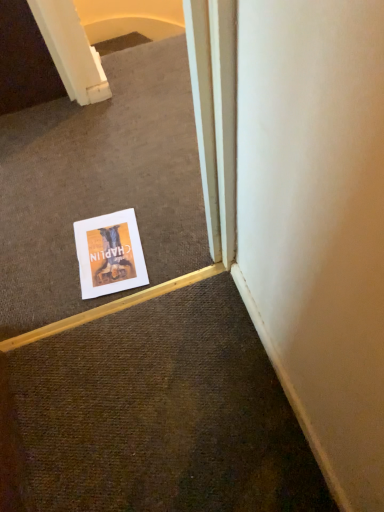
Question: Is white paper poster at center to the right of white paper at center from the viewer's perspective?

Choices:
 (A) no
 (B) yes

Answer: (B)

Question: Is white paper poster at center smaller than white paper at center?

Choices:
 (A) no
 (B) yes

Answer: (B)

Question: Would you say white paper poster at center is outside white paper at center?

Choices:
 (A) no
 (B) yes

Answer: (A)

Question: Can you confirm if white paper poster at center is taller than white paper at center?

Choices:
 (A) no
 (B) yes

Answer: (A)

Question: Can you confirm if white paper poster at center is bigger than white paper at center?

Choices:
 (A) no
 (B) yes

Answer: (A)

Question: Considering the relative sizes of white paper poster at center and white paper at center in the image provided, is white paper poster at center shorter than white paper at center?

Choices:
 (A) no
 (B) yes

Answer: (B)

Question: From the image's perspective, is white paper at center located beneath white paper poster at center?

Choices:
 (A) yes
 (B) no

Answer: (B)

Question: Is white paper at center closer to the viewer compared to white paper poster at center?

Choices:
 (A) no
 (B) yes

Answer: (B)

Question: From a real-world perspective, is white paper at center physically above white paper poster at center?

Choices:
 (A) yes
 (B) no

Answer: (A)

Question: Is white paper at center to the right of white paper poster at center from the viewer's perspective?

Choices:
 (A) no
 (B) yes

Answer: (A)

Question: Is white paper at center located outside white paper poster at center?

Choices:
 (A) yes
 (B) no

Answer: (A)

Question: From the image's perspective, is white paper at center on white paper poster at center?

Choices:
 (A) no
 (B) yes

Answer: (B)

Question: In the image, is white paper poster at center on the left side or the right side of white paper at center?

Choices:
 (A) left
 (B) right

Answer: (B)